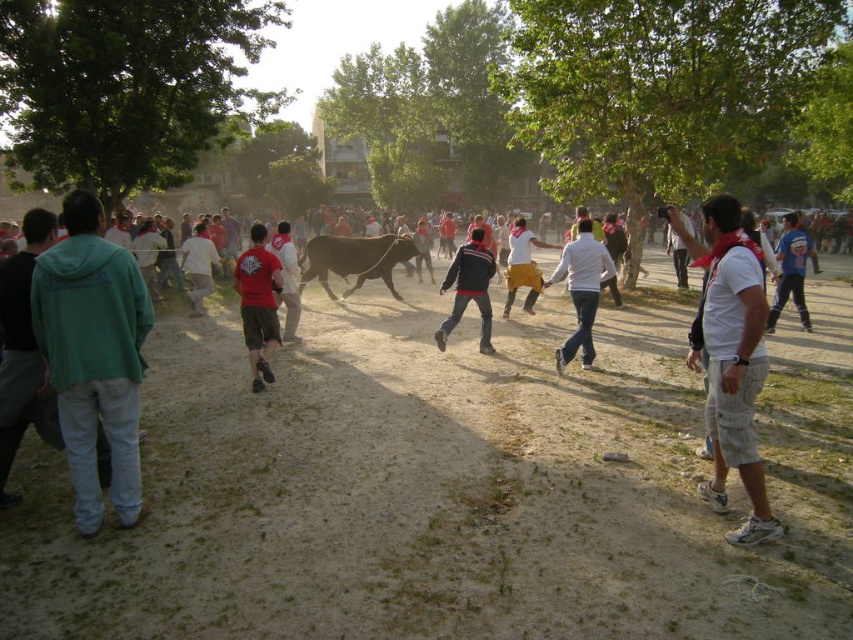
Question: Which point is farther from the camera taking this photo?

Choices:
 (A) (73, 552)
 (B) (32, 291)
 (C) (531, 296)
 (D) (479, 264)

Answer: (C)

Question: Observing the image, what is the correct spatial positioning of matte red shirt at center in reference to dark blue jacket at center?

Choices:
 (A) right
 (B) left

Answer: (B)

Question: Which of the following is the farthest from the observer?

Choices:
 (A) green denim jacket at left
 (B) brown sandy dirt field at center

Answer: (A)

Question: Can you confirm if white cotton shirt at center is bigger than yellow cotton pants at center?

Choices:
 (A) no
 (B) yes

Answer: (B)

Question: Is brown sandy dirt field at center smaller than yellow cotton pants at center?

Choices:
 (A) yes
 (B) no

Answer: (B)

Question: Among these points, which one is farthest from the camera?

Choices:
 (A) (523, 269)
 (B) (270, 339)

Answer: (A)